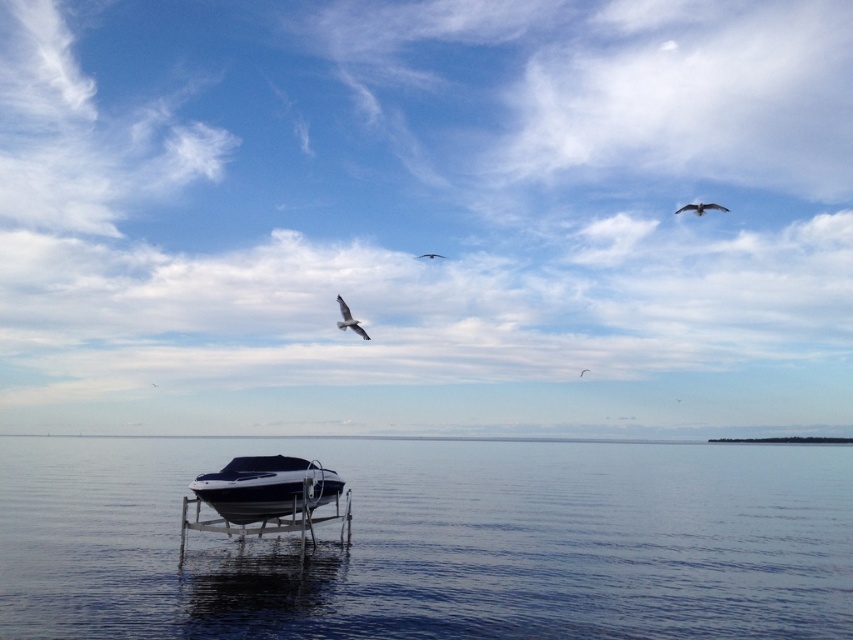
You are standing at the center of the metal platform and see the point at coordinates point (349, 320). What object is located at that point?

The point (349, 320) corresponds to a white feathered bird at center.

You are standing at the camera position and want to walk to point (289, 515). The path is clear. Can you walk there in 10 seconds if your walking speed is 3.5 feet per second?

The distance between you and point (289, 515) is 55.80 feet. At a speed of 3.5 feet per second, it would take approximately 16 seconds to reach the point. Therefore, you cannot walk there in 10 seconds.